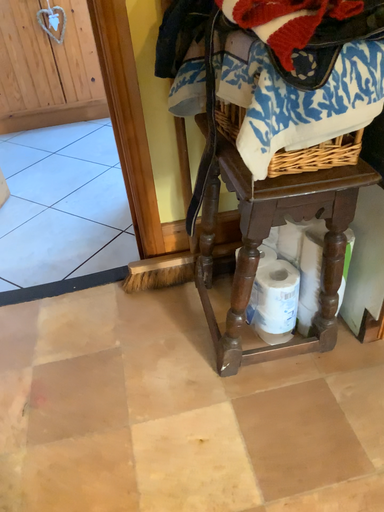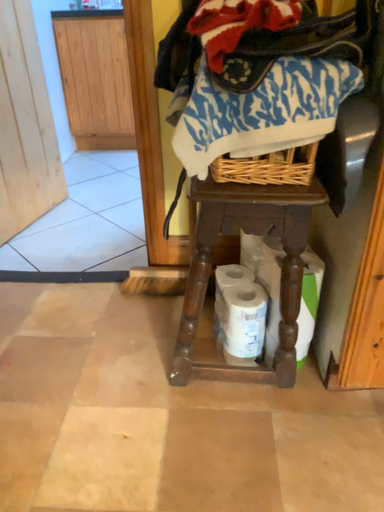
Question: Which way did the camera rotate in the video?

Choices:
 (A) rotated downward
 (B) rotated upward

Answer: (B)